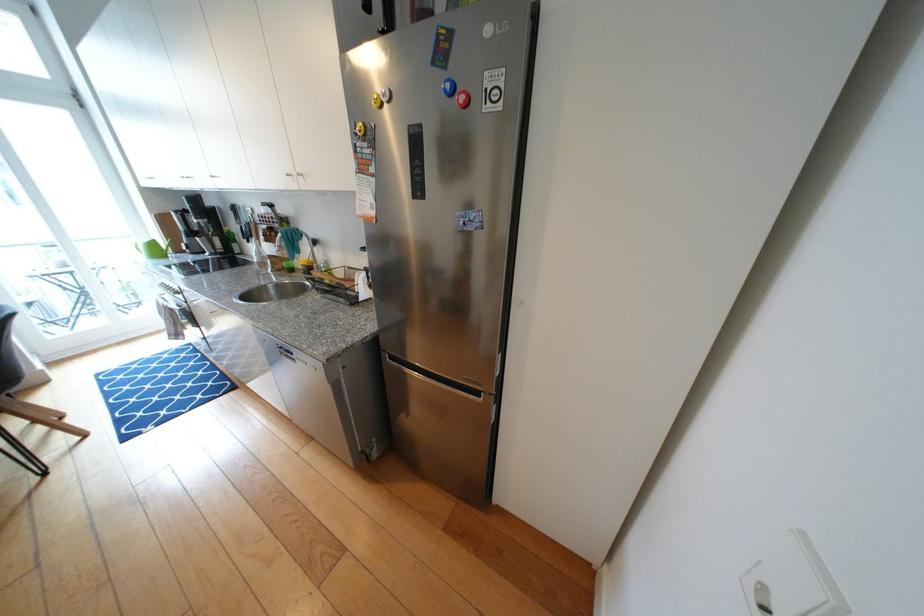
Describe the element at coordinates (784, 582) in the screenshot. I see `the light switch` at that location.